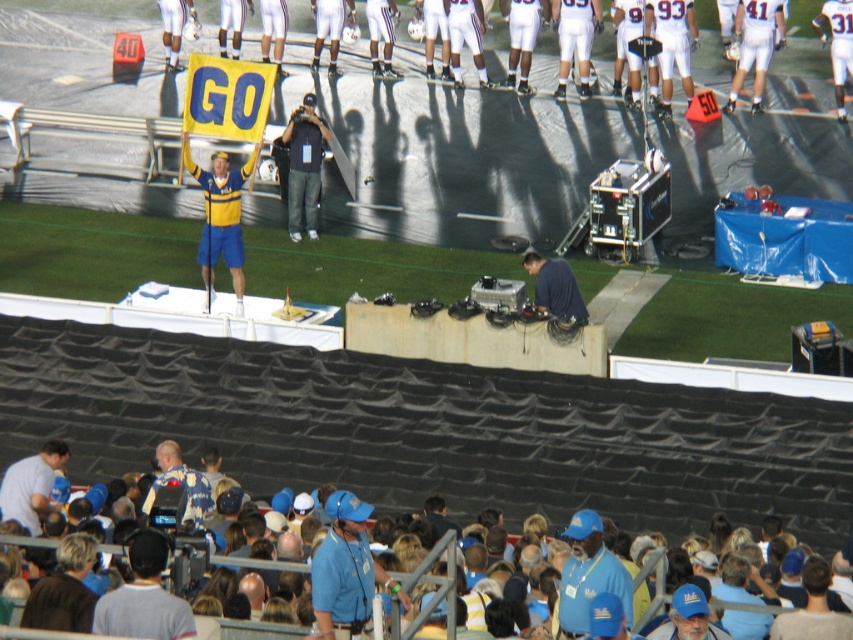
Question: Can you confirm if gray cotton shirt at lower left is positioned to the left of blue fabric cap at lower center?

Choices:
 (A) yes
 (B) no

Answer: (A)

Question: Does white matte uniform at upper center have a larger size compared to gray cotton shirt at lower left?

Choices:
 (A) no
 (B) yes

Answer: (B)

Question: Which of the following is the closest to the observer?

Choices:
 (A) denim jeans at center
 (B) dark blue shirt at center

Answer: (B)

Question: Which object is positioned closest to the light blue shirt at lower left?

Choices:
 (A) blue fabric hat at lower right
 (B) blue fabric cap at lower right

Answer: (B)

Question: Is white matte uniform at upper center further to the viewer compared to blue denim jacket at lower center?

Choices:
 (A) yes
 (B) no

Answer: (A)

Question: Estimate the real-world distances between objects in this image. Which object is closer to the blue fabric cap at center?

Choices:
 (A) dark blue shirt at center
 (B) blue fabric cap at lower right

Answer: (B)